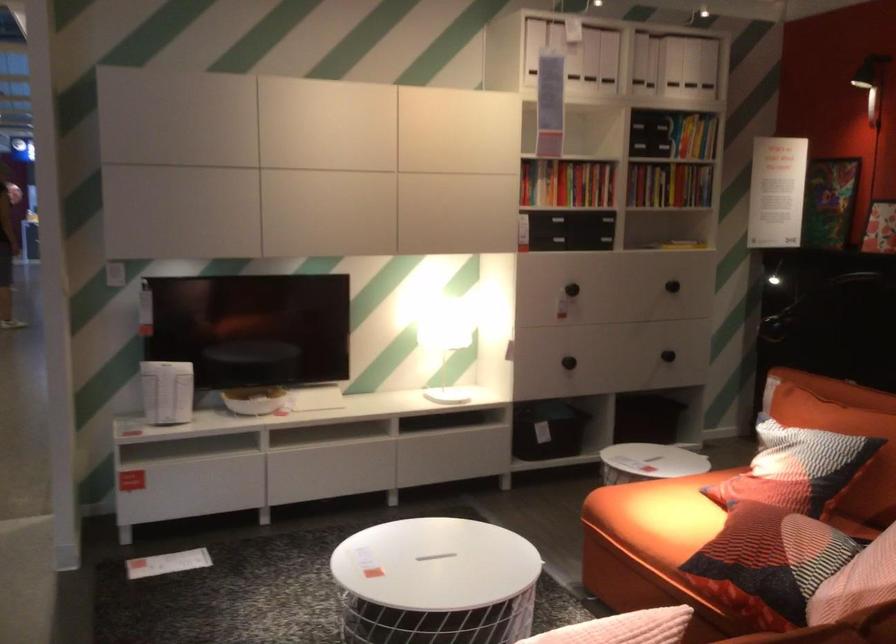
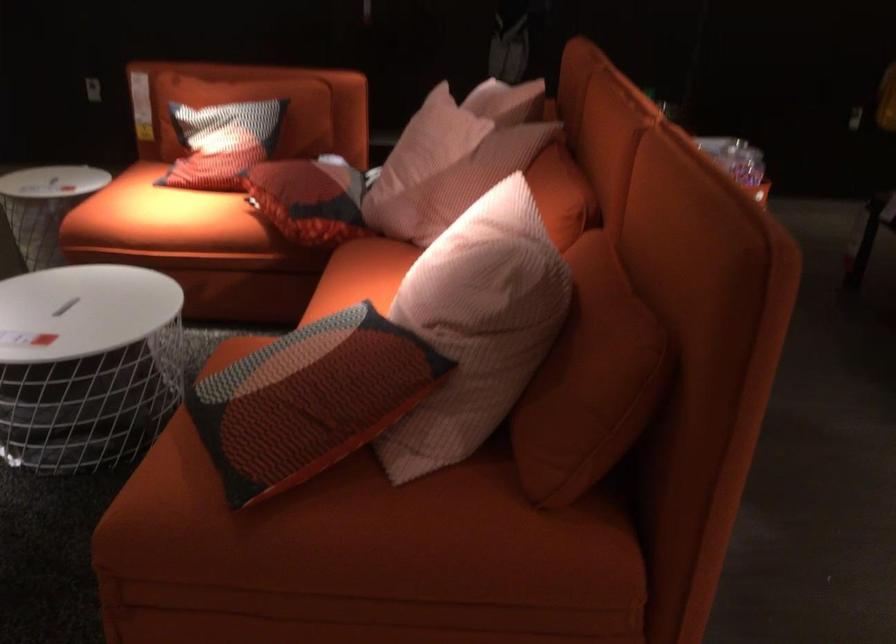
In the second image, find the point that corresponds to the point at 655,522 in the first image.

(160, 216)